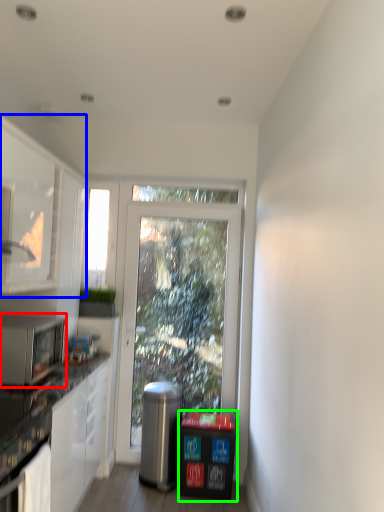
Question: Which object is the closest to the microwave oven (highlighted by a red box)? Choose among these: cabinetry (highlighted by a blue box) or recycling bin (highlighted by a green box).

Choices:
 (A) cabinetry
 (B) recycling bin

Answer: (A)